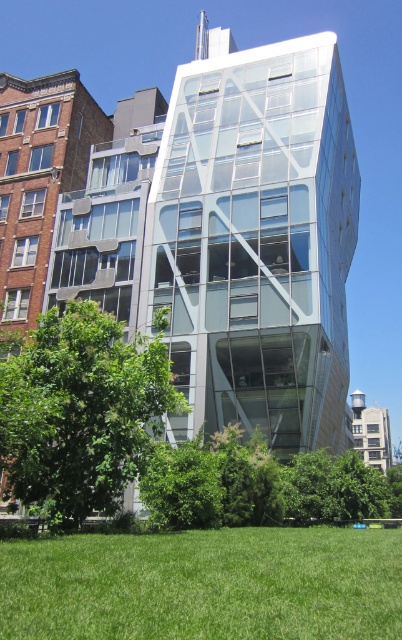
Question: Which of the following is the closest to the observer?

Choices:
 (A) (227, 540)
 (B) (100, 372)
 (C) (285, 497)

Answer: (B)

Question: Is green grass at lower center closer to the viewer compared to green leafy tree at lower center?

Choices:
 (A) no
 (B) yes

Answer: (B)

Question: Is green leafy tree at lower left bigger than green leafy tree at lower center?

Choices:
 (A) no
 (B) yes

Answer: (A)

Question: Estimate the real-world distances between objects in this image. Which object is closer to the green grass at lower center?

Choices:
 (A) green leafy tree at lower center
 (B) green leafy tree at lower left

Answer: (B)

Question: Which point is closer to the camera taking this photo?

Choices:
 (A) tap(352, 472)
 (B) tap(71, 493)
 (C) tap(250, 636)

Answer: (C)

Question: Does green leafy tree at lower left appear on the right side of green leafy tree at lower center?

Choices:
 (A) no
 (B) yes

Answer: (A)